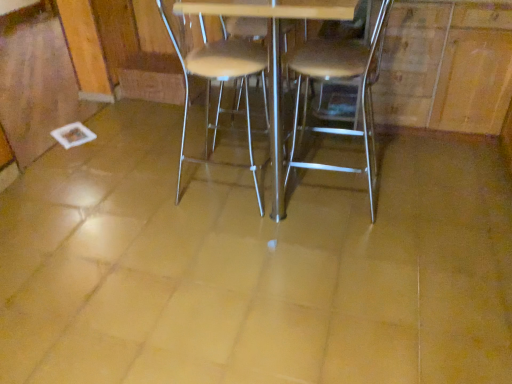
Question: From the image's perspective, is metallic silver table at center on metallic silver chair at center, arranged as the second chair when viewed from the right?

Choices:
 (A) no
 (B) yes

Answer: (B)

Question: Considering the relative sizes of metallic silver table at center and metallic silver chair at center, arranged as the second chair when viewed from the right, in the image provided, is metallic silver table at center shorter than metallic silver chair at center, arranged as the second chair when viewed from the right,?

Choices:
 (A) yes
 (B) no

Answer: (B)

Question: Can you confirm if metallic silver table at center is smaller than metallic silver chair at center, which appears as the first chair when viewed from the left?

Choices:
 (A) yes
 (B) no

Answer: (B)

Question: From the image's perspective, does metallic silver table at center appear lower than metallic silver chair at center, arranged as the second chair when viewed from the right?

Choices:
 (A) yes
 (B) no

Answer: (B)

Question: Is metallic silver table at center far away from metallic silver chair at center, which appears as the first chair when viewed from the left?

Choices:
 (A) no
 (B) yes

Answer: (A)

Question: Is metallic silver chair at center, arranged as the second chair when viewed from the right, spatially inside metallic silver table at center, or outside of it?

Choices:
 (A) inside
 (B) outside

Answer: (A)

Question: Considering the positions of metallic silver chair at center, arranged as the second chair when viewed from the right, and metallic silver table at center in the image, is metallic silver chair at center, arranged as the second chair when viewed from the right, bigger or smaller than metallic silver table at center?

Choices:
 (A) big
 (B) small

Answer: (B)

Question: In terms of width, does metallic silver chair at center, arranged as the second chair when viewed from the right, look wider or thinner when compared to metallic silver table at center?

Choices:
 (A) thin
 (B) wide

Answer: (A)

Question: From a real-world perspective, is metallic silver chair at center, arranged as the second chair when viewed from the right, above or below metallic silver table at center?

Choices:
 (A) below
 (B) above

Answer: (A)

Question: From the image's perspective, relative to metallic silver table at center, is metallic silver chair at center, the first chair positioned from the right, above or below?

Choices:
 (A) below
 (B) above

Answer: (A)

Question: In terms of width, does metallic silver chair at center, the first chair positioned from the right, look wider or thinner when compared to metallic silver table at center?

Choices:
 (A) wide
 (B) thin

Answer: (B)

Question: Is point (338, 127) positioned closer to the camera than point (273, 188)?

Choices:
 (A) farther
 (B) closer

Answer: (A)

Question: Is metallic silver chair at center, which appears as the 2th chair when viewed from the left, bigger or smaller than metallic silver table at center?

Choices:
 (A) big
 (B) small

Answer: (B)

Question: Is metallic silver table at center inside or outside of metallic silver chair at center, which appears as the first chair when viewed from the left?

Choices:
 (A) inside
 (B) outside

Answer: (B)

Question: Looking at their shapes, would you say metallic silver table at center is wider or thinner than metallic silver chair at center, which appears as the first chair when viewed from the left?

Choices:
 (A) wide
 (B) thin

Answer: (A)